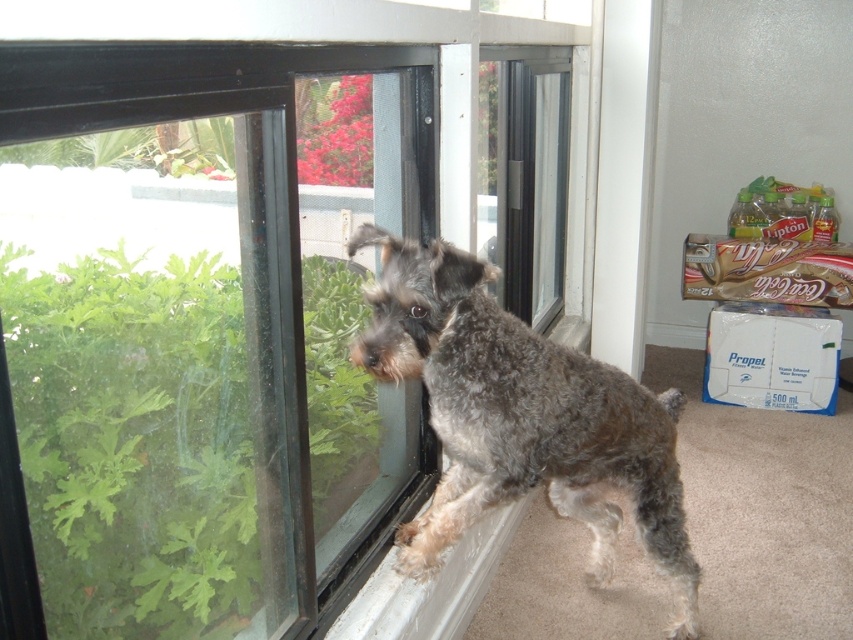
Who is taller, clear glass window at center or gray shaggy dog at window?

clear glass window at center is taller.

Which is in front, point (341, 150) or point (473, 358)?

Positioned in front is point (473, 358).

This screenshot has height=640, width=853. What do you see at coordinates (245, 285) in the screenshot? I see `clear glass window at center` at bounding box center [245, 285].

Image resolution: width=853 pixels, height=640 pixels. Find the location of `clear glass window at center`. clear glass window at center is located at coordinates (245, 285).